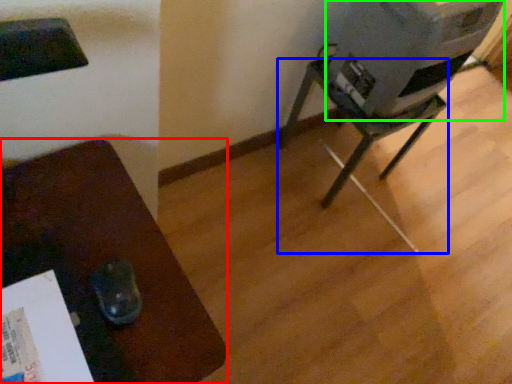
Question: Which object is positioned closest to furniture (highlighted by a red box)? Select from furniture (highlighted by a blue box) and water cooler (highlighted by a green box).

Choices:
 (A) furniture
 (B) water cooler

Answer: (B)